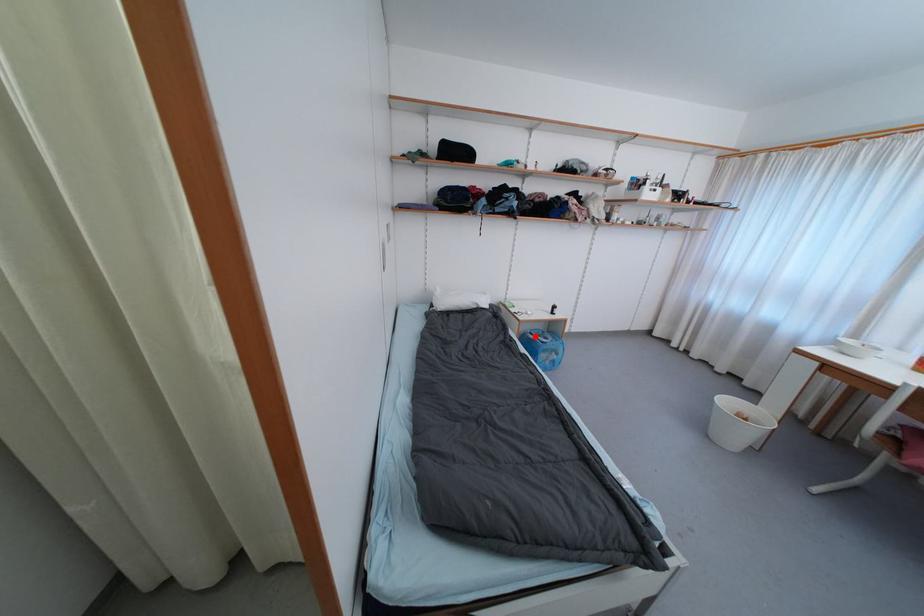
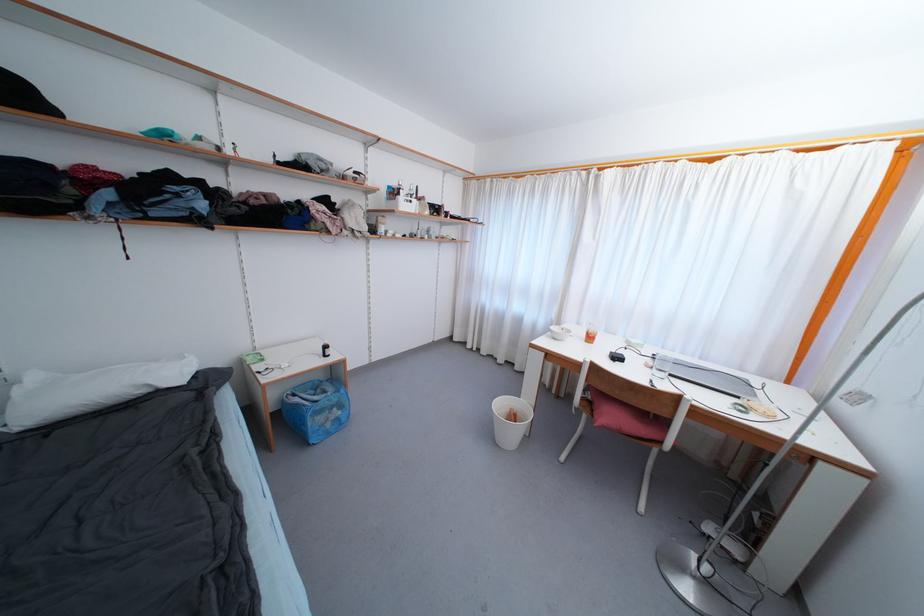
In the second image, find the point that corresponds to the highlighted location in the first image.

(298, 398)